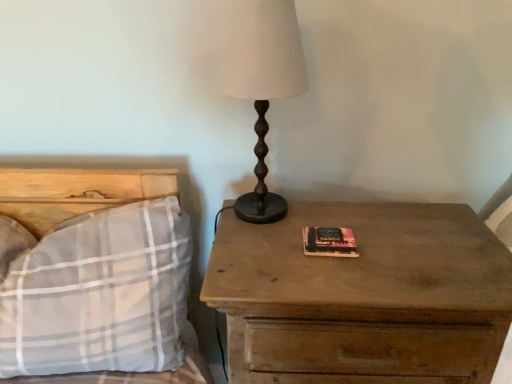
Locate an element on the screen. unoccupied area in front of matte brown table lamp at center is located at coordinates (277, 260).